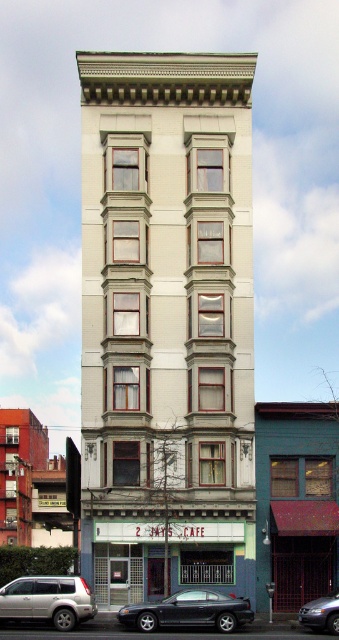
Who is taller, silver metallic suv at lower left or shiny black sedan at lower center?

With more height is silver metallic suv at lower left.

Who is more distant from viewer, (x=3, y=604) or (x=184, y=611)?

The point (x=3, y=604) is behind.

Where is `silver metallic suv at lower left`? silver metallic suv at lower left is located at coordinates pos(48,600).

Who is higher up, shiny black sedan at lower center or metallic silver sedan at lower right?

shiny black sedan at lower center is above.

Is point (208, 625) farther from viewer compared to point (330, 598)?

That is False.

The width and height of the screenshot is (339, 640). What are the coordinates of `shiny black sedan at lower center` in the screenshot? It's located at coord(189,611).

Measure the distance between silver metallic suv at lower left and metallic silver sedan at lower right.

A: 10.91 meters

Who is positioned more to the left, silver metallic suv at lower left or metallic silver sedan at lower right?

From the viewer's perspective, silver metallic suv at lower left appears more on the left side.

Who is more forward, (5, 608) or (310, 625)?

Answer: Point (5, 608)

Image resolution: width=339 pixels, height=640 pixels. I want to click on silver metallic suv at lower left, so click(48, 600).